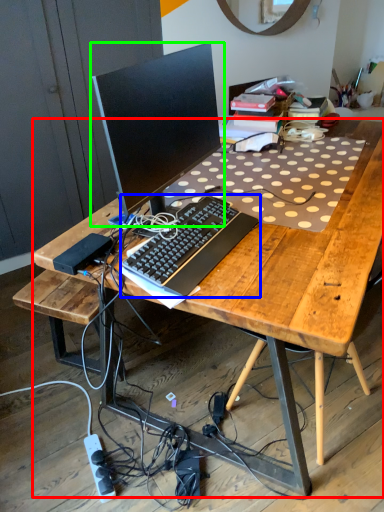
Question: Which is nearer to the desk (highlighted by a red box)? computer keyboard (highlighted by a blue box) or computer monitor (highlighted by a green box).

Choices:
 (A) computer keyboard
 (B) computer monitor

Answer: (A)